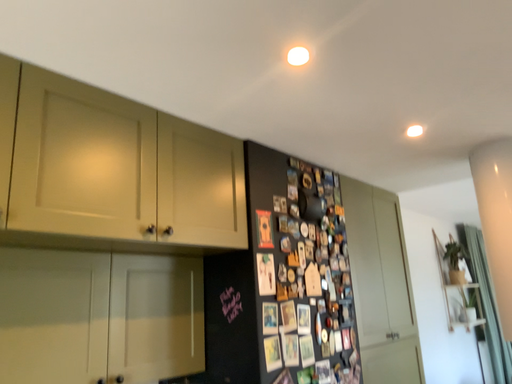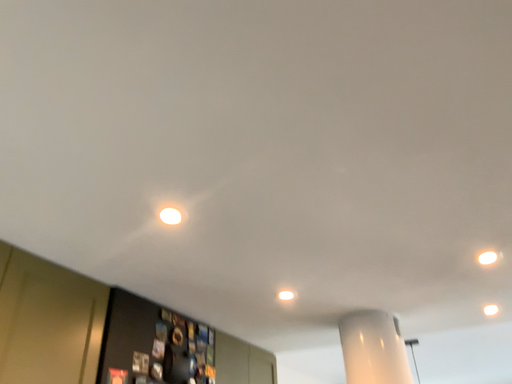
Question: How did the camera likely rotate when shooting the video?

Choices:
 (A) rotated upward
 (B) rotated downward

Answer: (A)